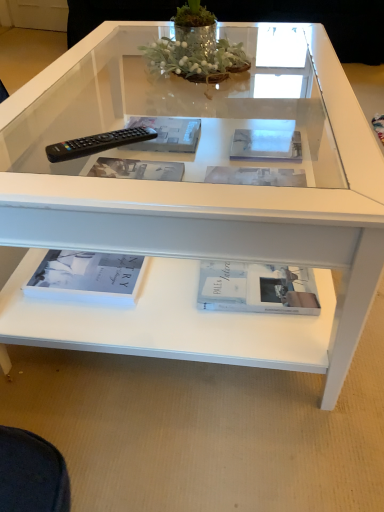
Question: Can you confirm if white glossy magazine at center, which is counted as the first magazine, starting from the right, is shorter than clear plastic magazine at center, positioned as the 1th magazine in left-to-right order?

Choices:
 (A) yes
 (B) no

Answer: (A)

Question: Could you tell me if white glossy magazine at center, arranged as the second magazine when viewed from the left, is turned towards clear plastic magazine at center, positioned as the 1th magazine in left-to-right order?

Choices:
 (A) no
 (B) yes

Answer: (A)

Question: Considering the relative positions of white glossy magazine at center, arranged as the second magazine when viewed from the left, and clear plastic magazine at center, the second magazine from the right, in the image provided, is white glossy magazine at center, arranged as the second magazine when viewed from the left, to the left of clear plastic magazine at center, the second magazine from the right, from the viewer's perspective?

Choices:
 (A) yes
 (B) no

Answer: (B)

Question: From a real-world perspective, is white glossy magazine at center, which is counted as the first magazine, starting from the right, below clear plastic magazine at center, positioned as the 1th magazine in left-to-right order?

Choices:
 (A) no
 (B) yes

Answer: (B)

Question: Is white glossy magazine at center, which is counted as the first magazine, starting from the right, to the right of clear plastic magazine at center, the second magazine from the right, from the viewer's perspective?

Choices:
 (A) no
 (B) yes

Answer: (B)

Question: Choose the correct answer: Is white matte book at lower center, which ranks as the second book in left-to-right order, inside black plastic remote at left or outside it?

Choices:
 (A) outside
 (B) inside

Answer: (A)

Question: From the image's perspective, relative to black plastic remote at left, is white matte book at lower center, which is counted as the first book, starting from the right, above or below?

Choices:
 (A) above
 (B) below

Answer: (B)

Question: From a real-world perspective, relative to black plastic remote at left, is white matte book at lower center, which ranks as the second book in left-to-right order, vertically above or below?

Choices:
 (A) below
 (B) above

Answer: (A)

Question: Considering the positions of white matte book at lower center, which is counted as the first book, starting from the right, and black plastic remote at left in the image, is white matte book at lower center, which is counted as the first book, starting from the right, bigger or smaller than black plastic remote at left?

Choices:
 (A) small
 (B) big

Answer: (B)

Question: From a real-world perspective, is clear plastic magazine at center, positioned as the 1th magazine in left-to-right order, above or below white glossy magazine at center, arranged as the second magazine when viewed from the left?

Choices:
 (A) below
 (B) above

Answer: (B)

Question: Is clear plastic magazine at center, positioned as the 1th magazine in left-to-right order, bigger or smaller than white glossy magazine at center, arranged as the second magazine when viewed from the left?

Choices:
 (A) small
 (B) big

Answer: (B)

Question: In the image, is clear plastic magazine at center, positioned as the 1th magazine in left-to-right order, positioned in front of or behind white glossy magazine at center, arranged as the second magazine when viewed from the left?

Choices:
 (A) front
 (B) behind

Answer: (B)

Question: Visually, is clear plastic magazine at center, positioned as the 1th magazine in left-to-right order, positioned to the left or to the right of white glossy magazine at center, arranged as the second magazine when viewed from the left?

Choices:
 (A) right
 (B) left

Answer: (B)

Question: In the image, is black plastic remote at left positioned in front of or behind clear plastic magazine at center, the second magazine from the right?

Choices:
 (A) behind
 (B) front

Answer: (B)

Question: Would you say black plastic remote at left is inside or outside clear plastic magazine at center, positioned as the 1th magazine in left-to-right order?

Choices:
 (A) outside
 (B) inside

Answer: (A)